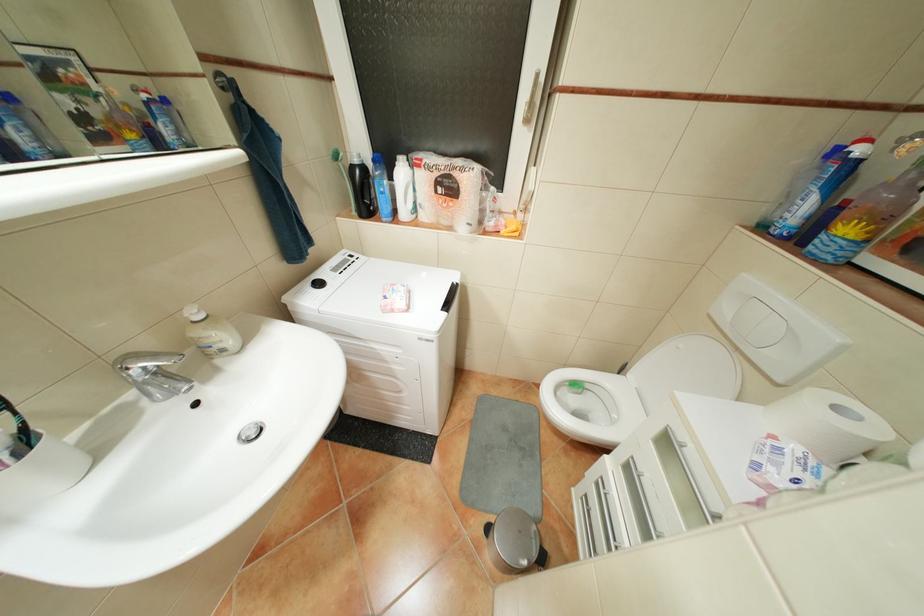
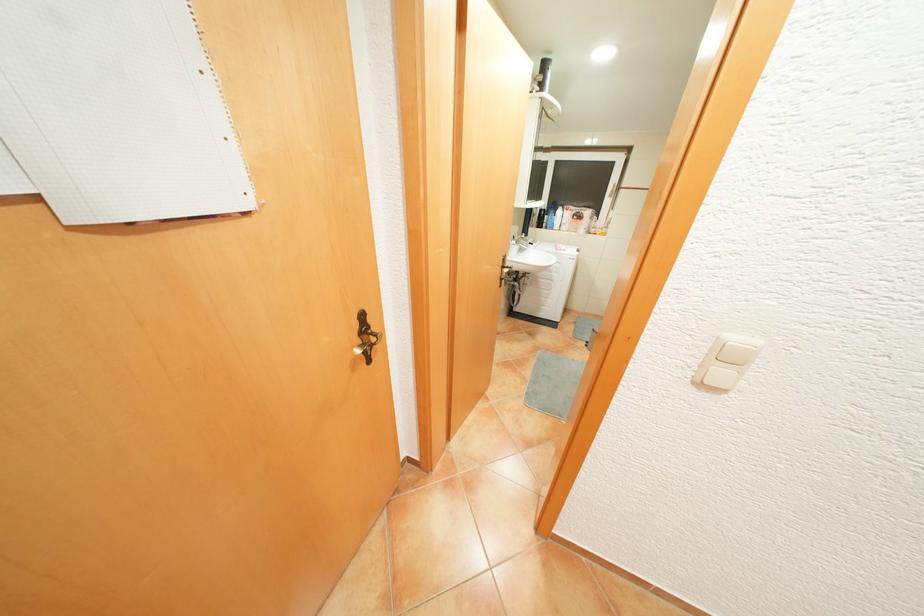
What movement of the cameraman would produce the second image?

The cameraman walked toward left, backward.